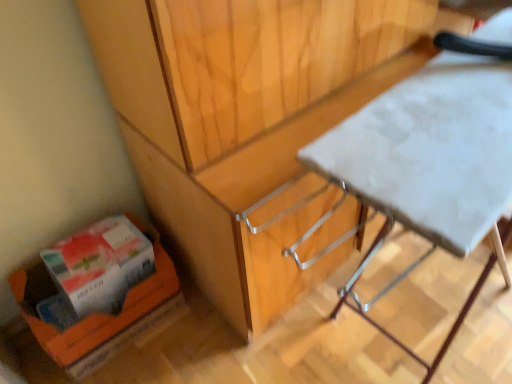
Question: Does orange cardboard box at lower left have a greater height compared to white fabric table at center?

Choices:
 (A) yes
 (B) no

Answer: (B)

Question: Can you confirm if orange cardboard box at lower left is shorter than white fabric table at center?

Choices:
 (A) no
 (B) yes

Answer: (B)

Question: Is orange cardboard box at lower left next to white fabric table at center and touching it?

Choices:
 (A) no
 (B) yes

Answer: (A)

Question: From a real-world perspective, is orange cardboard box at lower left over white fabric table at center?

Choices:
 (A) yes
 (B) no

Answer: (B)

Question: From a real-world perspective, is orange cardboard box at lower left under white fabric table at center?

Choices:
 (A) no
 (B) yes

Answer: (B)

Question: Is orange cardboard box at lower left looking in the opposite direction of white fabric table at center?

Choices:
 (A) no
 (B) yes

Answer: (A)

Question: Is white fabric table at center facing away from orange cardboard box at lower left?

Choices:
 (A) no
 (B) yes

Answer: (B)

Question: Is white fabric table at center far away from orange cardboard box at lower left?

Choices:
 (A) yes
 (B) no

Answer: (B)

Question: Does white fabric table at center lie behind orange cardboard box at lower left?

Choices:
 (A) yes
 (B) no

Answer: (B)

Question: Does white fabric table at center lie in front of orange cardboard box at lower left?

Choices:
 (A) yes
 (B) no

Answer: (A)

Question: Can we say white fabric table at center lies outside orange cardboard box at lower left?

Choices:
 (A) no
 (B) yes

Answer: (B)

Question: Can you confirm if white fabric table at center is wider than orange cardboard box at lower left?

Choices:
 (A) yes
 (B) no

Answer: (A)

Question: Is white fabric table at center placed right next to orange cardboard box at lower left?

Choices:
 (A) yes
 (B) no

Answer: (B)